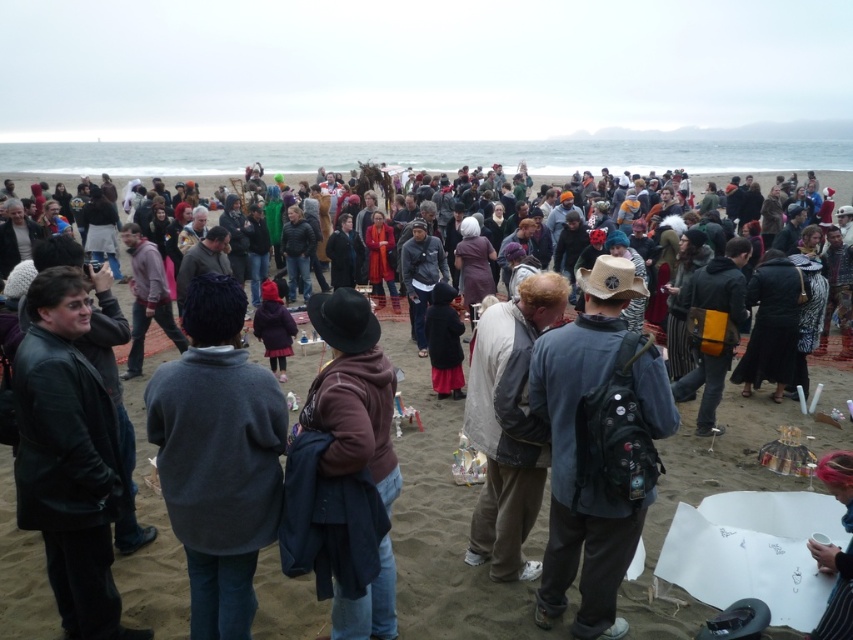
Which of these two, matte black jacket at center or leather jacket at left, stands shorter?

leather jacket at left

Between matte black jacket at center and leather jacket at left, which one is positioned lower?

leather jacket at left

Who is more distant from viewer, (303, 324) or (64, 540)?

The point (303, 324) is more distant.

Locate an element on the screen. matte black jacket at center is located at coordinates (442, 524).

At what (x,y) coordinates should I click in order to perform the action: click on dark gray sweater at center. Please return your answer as a coordinate pair (x, y). This screenshot has height=640, width=853. Looking at the image, I should click on (218, 456).

Can you confirm if dark gray sweater at center is smaller than denim jacket at center?

Yes, dark gray sweater at center is smaller than denim jacket at center.

Does point (234, 490) come farther from viewer compared to point (653, 358)?

That is False.

At what (x,y) coordinates should I click in order to perform the action: click on dark gray sweater at center. Please return your answer as a coordinate pair (x, y). This screenshot has width=853, height=640. Looking at the image, I should click on pos(218,456).

Who is positioned more to the left, matte black jacket at center or dark gray sweater at center?

From the viewer's perspective, dark gray sweater at center appears more on the left side.

Does matte black jacket at center have a lesser height compared to dark gray sweater at center?

No, matte black jacket at center is not shorter than dark gray sweater at center.

Find the location of a particular element. The height and width of the screenshot is (640, 853). matte black jacket at center is located at coordinates (442, 524).